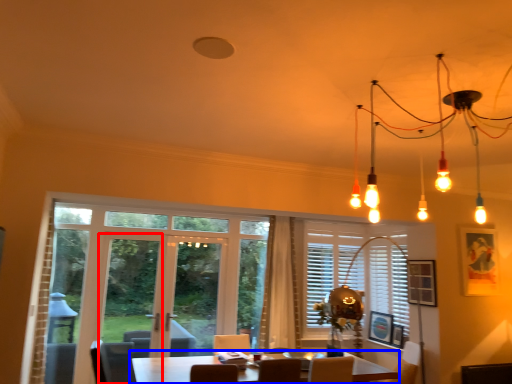
Question: Which of the following is the farthest to the observer, screen door (highlighted by a red box) or table (highlighted by a blue box)?

Choices:
 (A) screen door
 (B) table

Answer: (A)